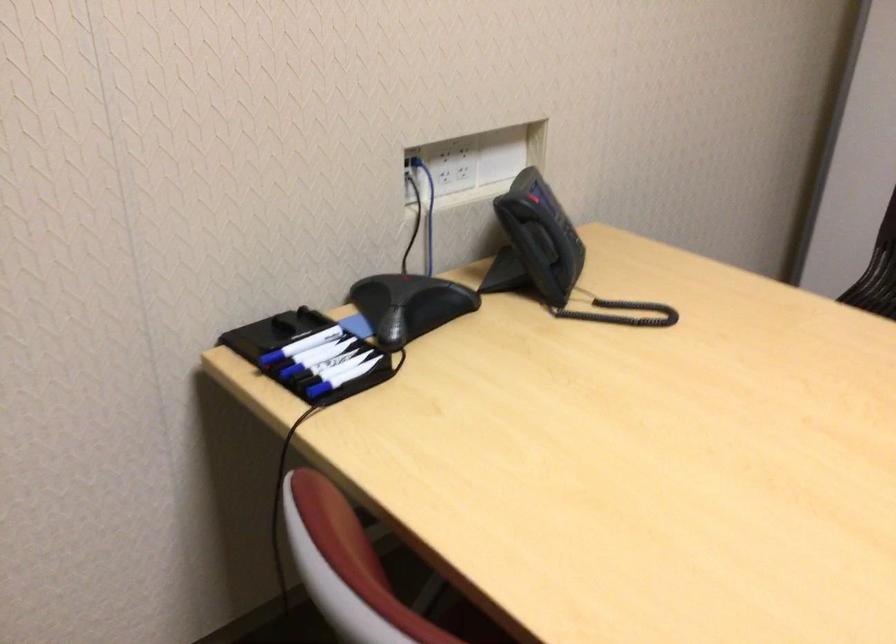
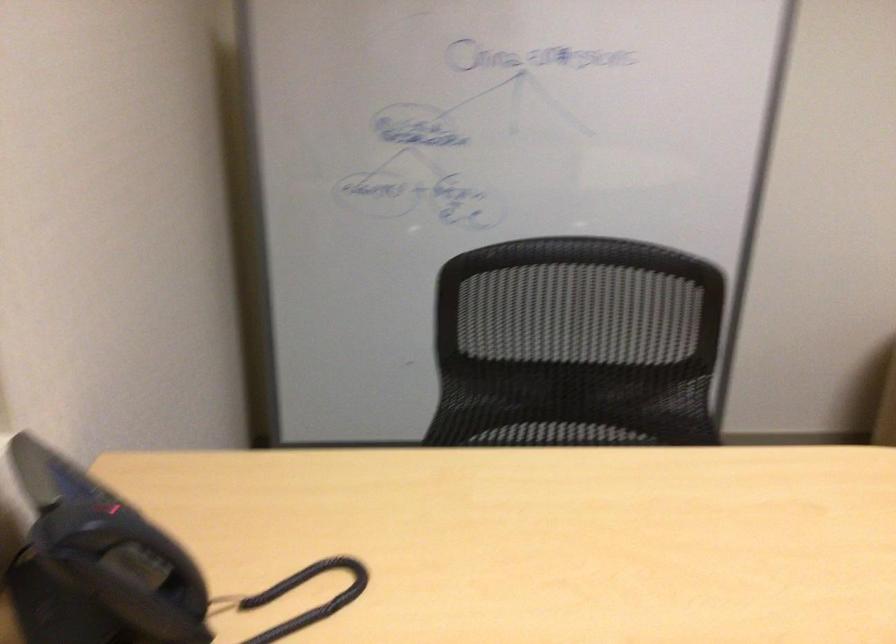
Question: The camera is either moving clockwise (left) or counter-clockwise (right) around the object. The first image is from the beginning of the video and the second image is from the end. Is the camera moving left or right when shooting the video?

Choices:
 (A) Left
 (B) Right

Answer: (A)